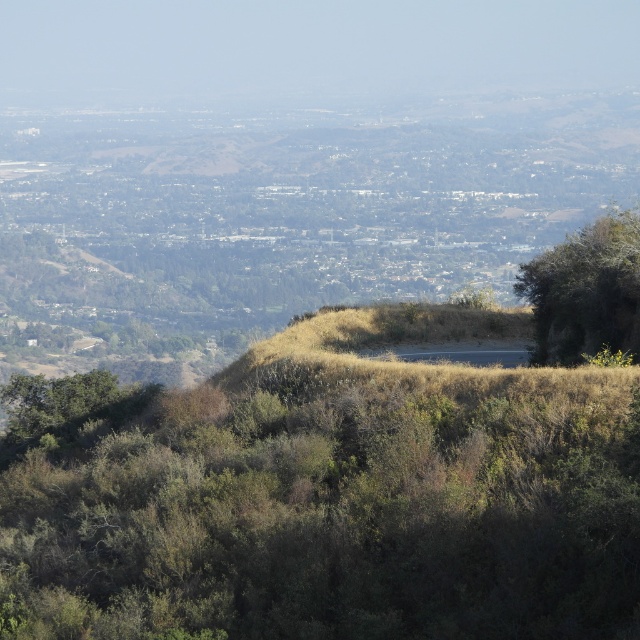
Does green leafy shrub at center have a larger size compared to green leafy tree at right?

Yes.

Image resolution: width=640 pixels, height=640 pixels. What are the coordinates of `green leafy shrub at center` in the screenshot? It's located at (323, 506).